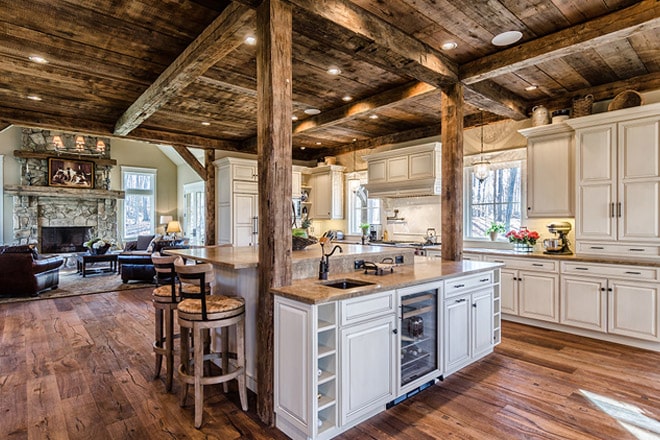
This screenshot has width=660, height=440. Find the location of `wooden support beams`. wooden support beams is located at coordinates (453, 128), (412, 92), (488, 68), (490, 101), (395, 62), (280, 44), (204, 54).